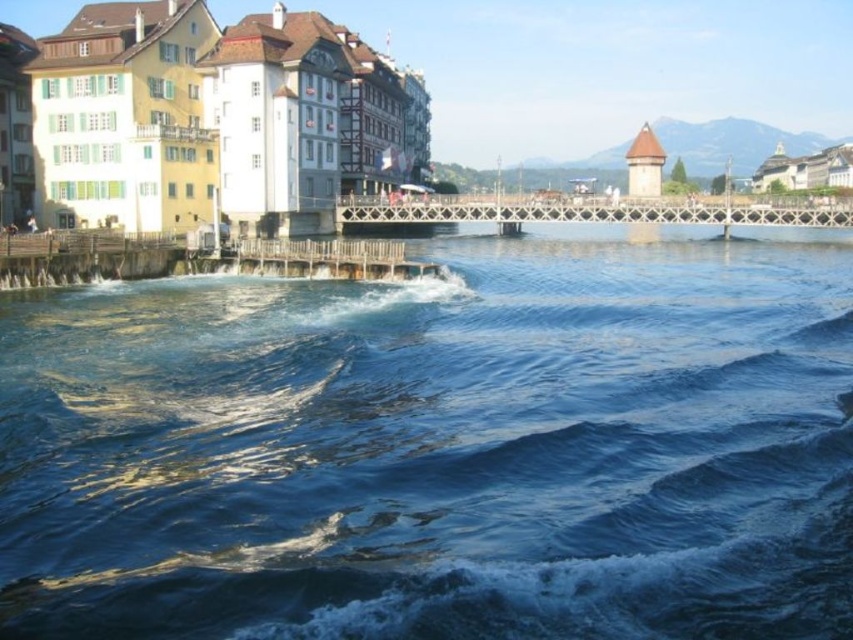
Question: Is blue clear water at center to the left of white painted wooden buildings at left from the viewer's perspective?

Choices:
 (A) no
 (B) yes

Answer: (A)

Question: Is blue clear water at center positioned behind white painted wooden buildings at left?

Choices:
 (A) no
 (B) yes

Answer: (A)

Question: In this image, where is blue clear water at center located relative to white painted wooden buildings at left?

Choices:
 (A) below
 (B) above

Answer: (A)

Question: Which object is closer to the camera taking this photo?

Choices:
 (A) white painted wooden buildings at left
 (B) blue clear water at center

Answer: (B)